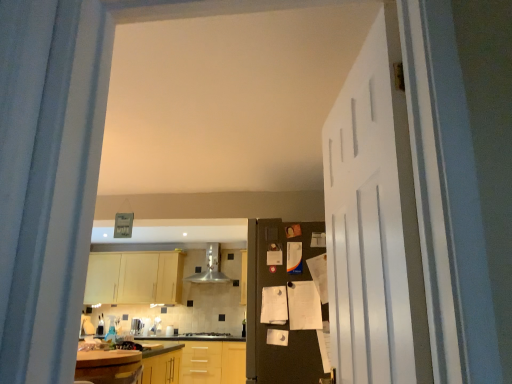
Question: In terms of width, does satin silver toaster at center look wider or thinner when compared to wooden at center, which is counted as the 1th countertop, starting from the back?

Choices:
 (A) wide
 (B) thin

Answer: (B)

Question: Is point (130, 329) positioned closer to the camera than point (187, 342)?

Choices:
 (A) farther
 (B) closer

Answer: (A)

Question: Which object is positioned farthest from the black matte refrigerator at center, acting as the first door starting from the back?

Choices:
 (A) light wood cabinet at center
 (B) wooden at center, positioned as the 2th countertop in front-to-back order
 (C) stainless steel exhaust hood at center
 (D) wooden laminate countertop at lower left, arranged as the second countertop when ordered from the bottom
 (E) white matte door at right, the 1th door in the front-to-back sequence

Answer: (A)

Question: Which object is the closest to the black matte refrigerator at center, positioned as the 2th door in front-to-back order?

Choices:
 (A) wooden laminate countertop at lower left, the first countertop viewed from the front
 (B) white matte door at right, arranged as the 2th door when viewed from the back
 (C) satin silver toaster at center
 (D) wooden at center, which is counted as the 1th countertop, starting from the back
 (E) light wood cabinet at center

Answer: (B)